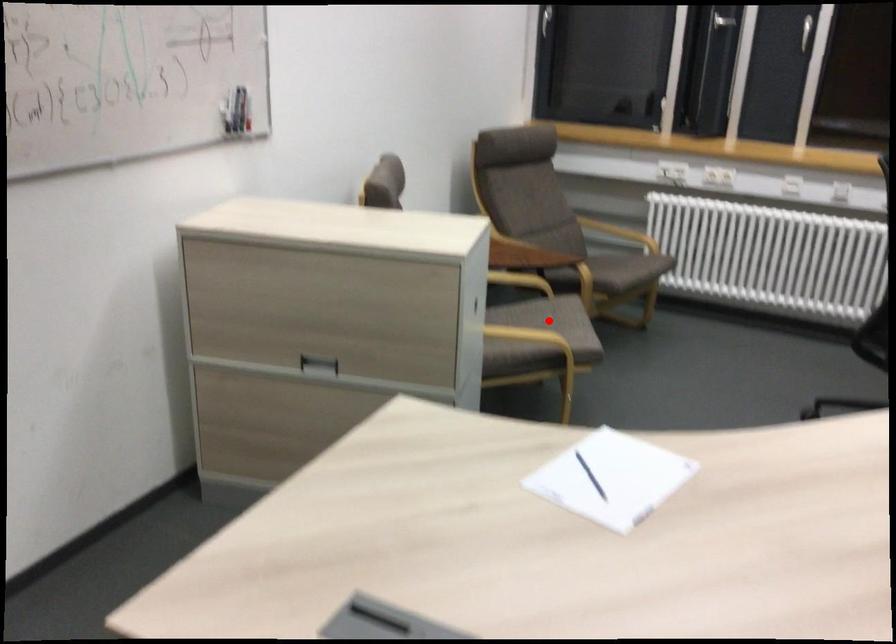
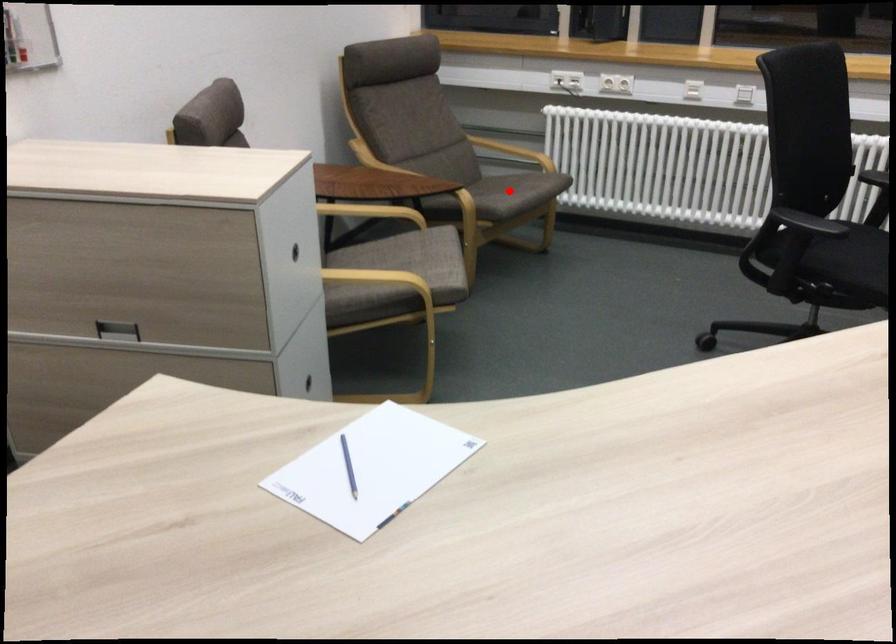
I am providing you with two images of the same scene from different viewpoints. A red point is marked on the first image and another point is marked on the second image. Do the highlighted points in image1 and image2 indicate the same real-world spot?

No